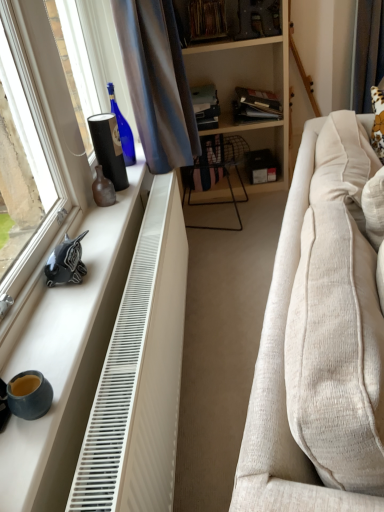
The width and height of the screenshot is (384, 512). Identify the location of free space behind matte blue coffee cup at lower left. (x=46, y=352).